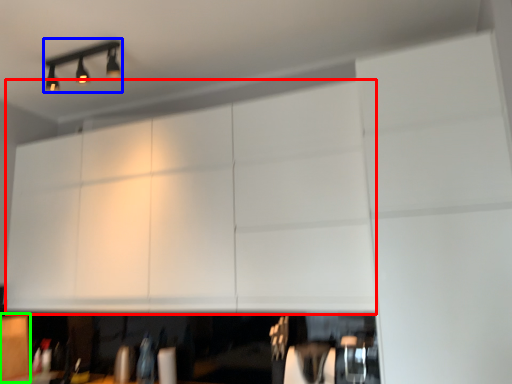
Question: Considering the real-world distances, which object is farthest from cabinetry (highlighted by a red box)? lamp (highlighted by a blue box) or cabinetry (highlighted by a green box)?

Choices:
 (A) lamp
 (B) cabinetry

Answer: (B)